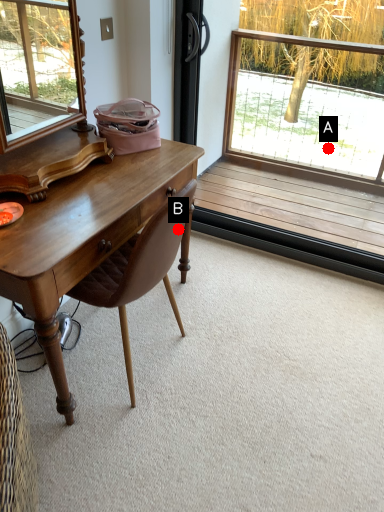
Question: Two points are circled on the image, labeled by A and B beside each circle. Among these points, which one is nearest to the camera?

Choices:
 (A) A is closer
 (B) B is closer

Answer: (B)